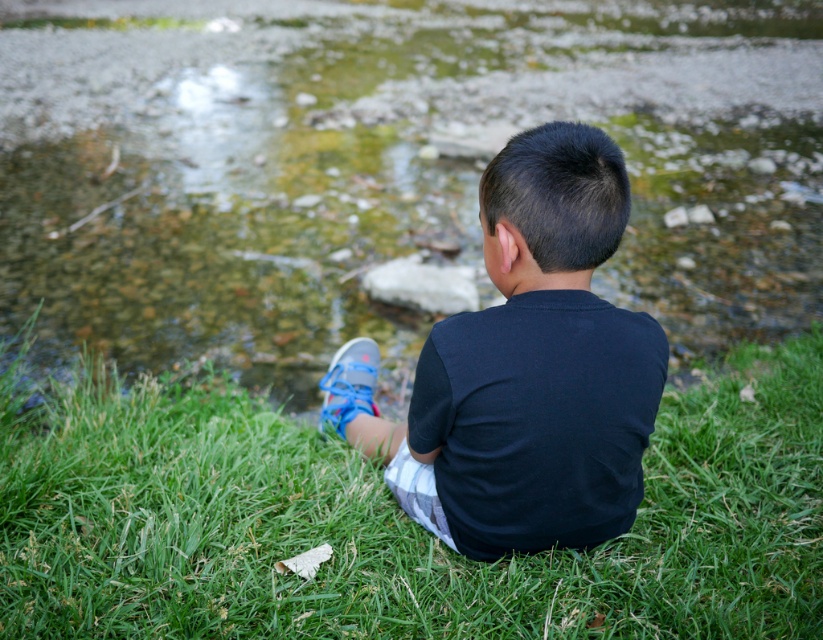
At what (x,y) coordinates should I click in order to perform the action: click on green mossy river at center. Please return your answer as a coordinate pair (x, y). Looking at the image, I should click on (386, 164).

Does green mossy river at center come behind green grass at lower center?

Yes.

Is point (384, 36) farther from camera compared to point (122, 534)?

Yes.

Where is `green mossy river at center`? The image size is (823, 640). green mossy river at center is located at coordinates (x=386, y=164).

Does green grass at lower center have a lesser width compared to blue mesh shoe at lower center?

No.

Where is `green grass at lower center`? Image resolution: width=823 pixels, height=640 pixels. green grass at lower center is located at coordinates (389, 518).

Can you confirm if green mossy river at center is shorter than blue mesh shoe at lower center?

No, green mossy river at center is not shorter than blue mesh shoe at lower center.

Consider the image. Does green mossy river at center appear under blue mesh shoe at lower center?

Incorrect, green mossy river at center is not positioned below blue mesh shoe at lower center.

Who is more distant from viewer, (x=336, y=36) or (x=373, y=346)?

Point (x=336, y=36)

Identify the location of green mossy river at center. This screenshot has height=640, width=823. (386, 164).